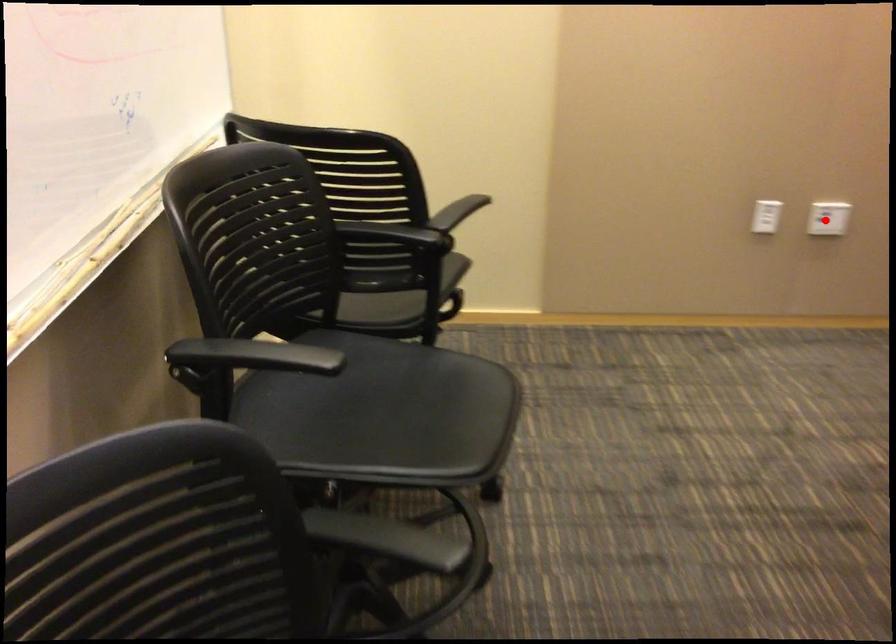
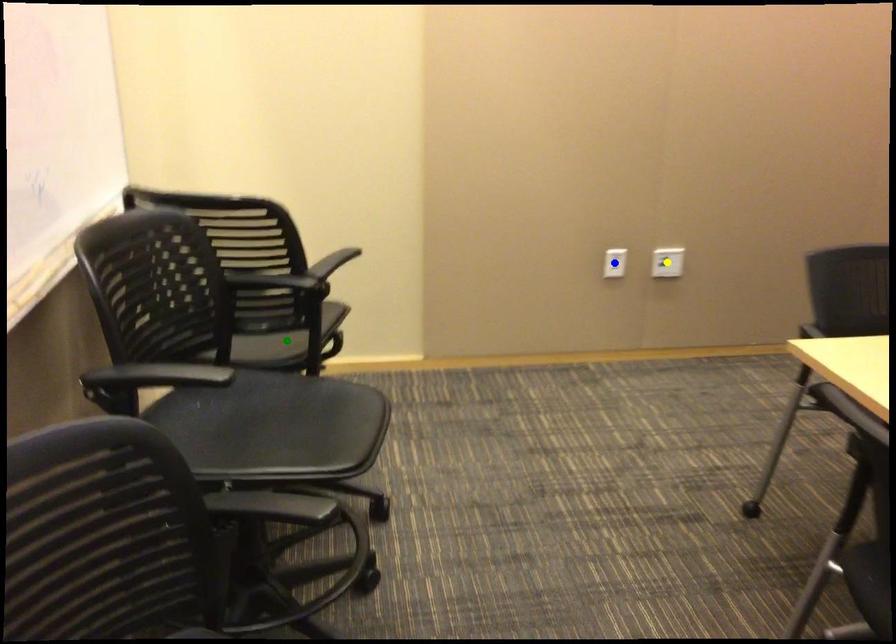
Question: I am providing you with two images of the same scene from different viewpoints. A red point is marked on the first image. You are given multiple points on the second image. Which point in image 2 is actually the same real-world point as the red point in image 1?

Choices:
 (A) yellow point
 (B) green point
 (C) blue point

Answer: (A)